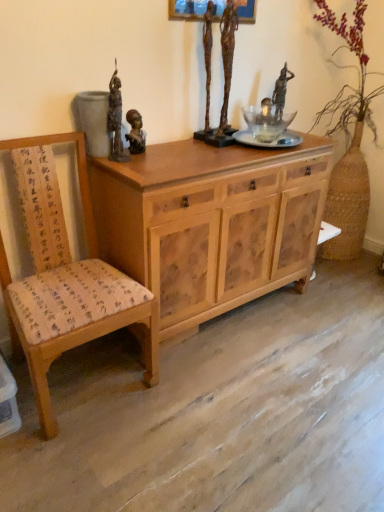
Identify the location of vacant area that is in front of bronze statue at upper left, which ranks as the 2th sculpture in right-to-left order. The image size is (384, 512). (132, 163).